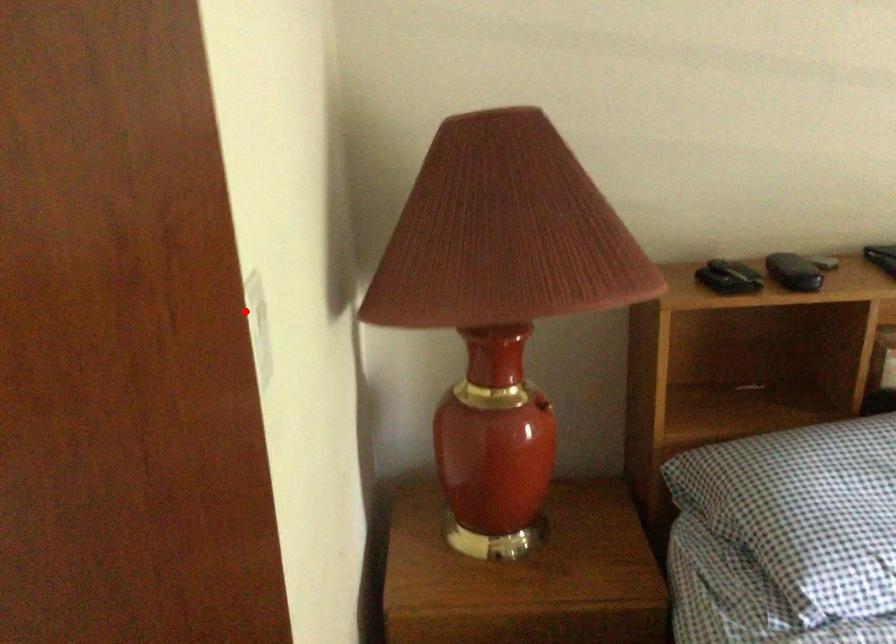
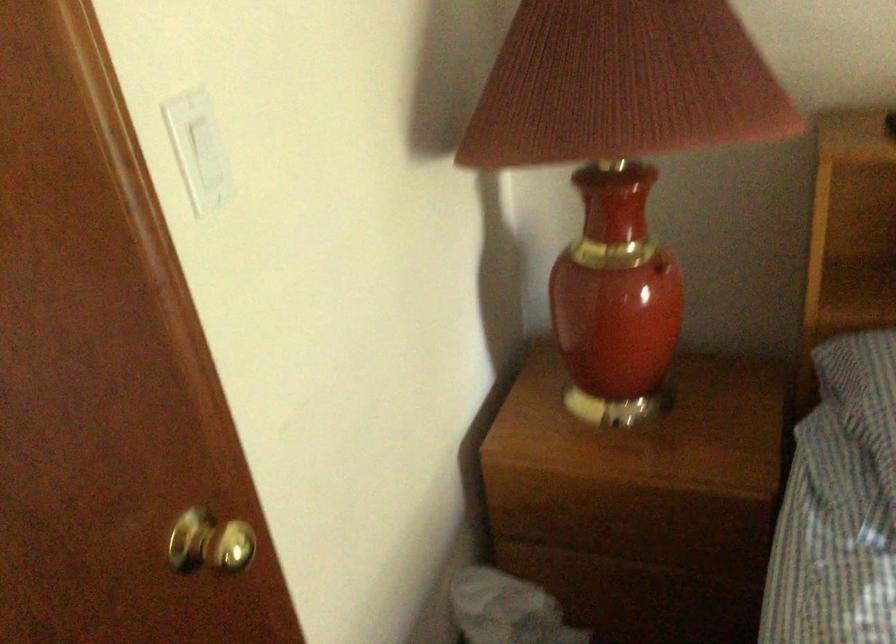
Where in the second image is the point corresponding to the highlighted location from the first image?

(197, 149)